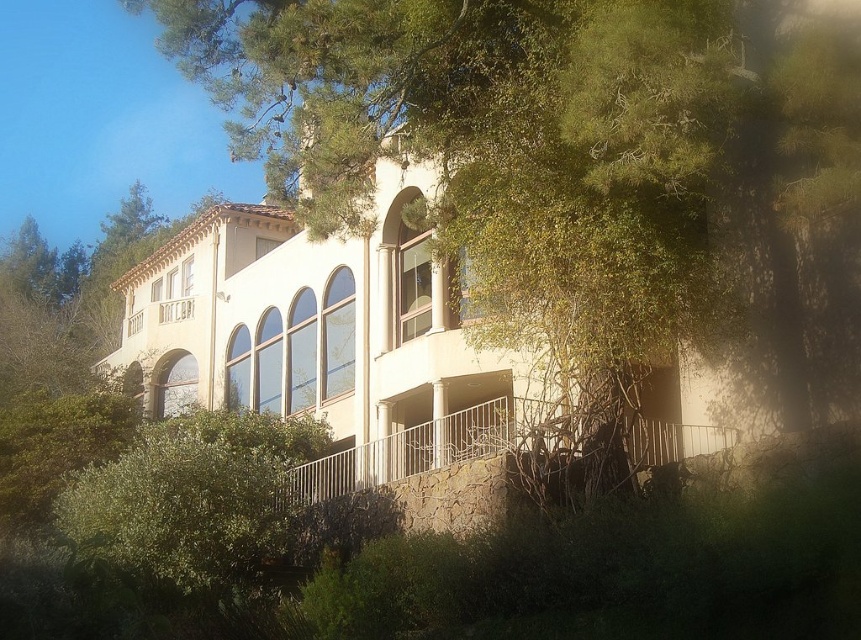
Question: Which point appears closest to the camera in this image?

Choices:
 (A) (404, 285)
 (B) (646, 460)

Answer: (B)

Question: Does white stucco villa at center have a greater width compared to white metal railing at lower center?

Choices:
 (A) no
 (B) yes

Answer: (B)

Question: Considering the relative positions of white stucco villa at center and white metal railing at lower center in the image provided, where is white stucco villa at center located with respect to white metal railing at lower center?

Choices:
 (A) left
 (B) right

Answer: (A)

Question: Does white stucco villa at center appear on the right side of white metal railing at lower center?

Choices:
 (A) yes
 (B) no

Answer: (B)

Question: Which point is farther from the camera taking this photo?

Choices:
 (A) (630, 456)
 (B) (160, 320)

Answer: (B)

Question: Which point is farther from the camera taking this photo?

Choices:
 (A) (319, 289)
 (B) (447, 428)

Answer: (A)